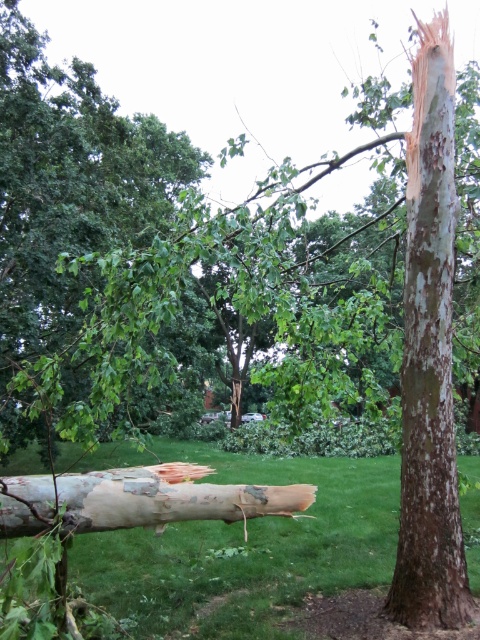
Question: Which object appears closest to the camera in this image?

Choices:
 (A) smooth brown bark at right
 (B) green grass at lower left
 (C) white bark log at center

Answer: (C)

Question: Is green grass at lower left positioned in front of smooth brown bark at right?

Choices:
 (A) no
 (B) yes

Answer: (A)

Question: Does smooth brown bark at right appear over white bark log at center?

Choices:
 (A) no
 (B) yes

Answer: (B)

Question: Among these points, which one is nearest to the camera?

Choices:
 (A) (403, 618)
 (B) (33, 532)

Answer: (B)

Question: Which of the following is the farthest from the observer?

Choices:
 (A) green grass at lower left
 (B) smooth brown bark at right

Answer: (A)

Question: Can you confirm if green grass at lower left is positioned to the right of smooth brown bark at right?

Choices:
 (A) no
 (B) yes

Answer: (A)